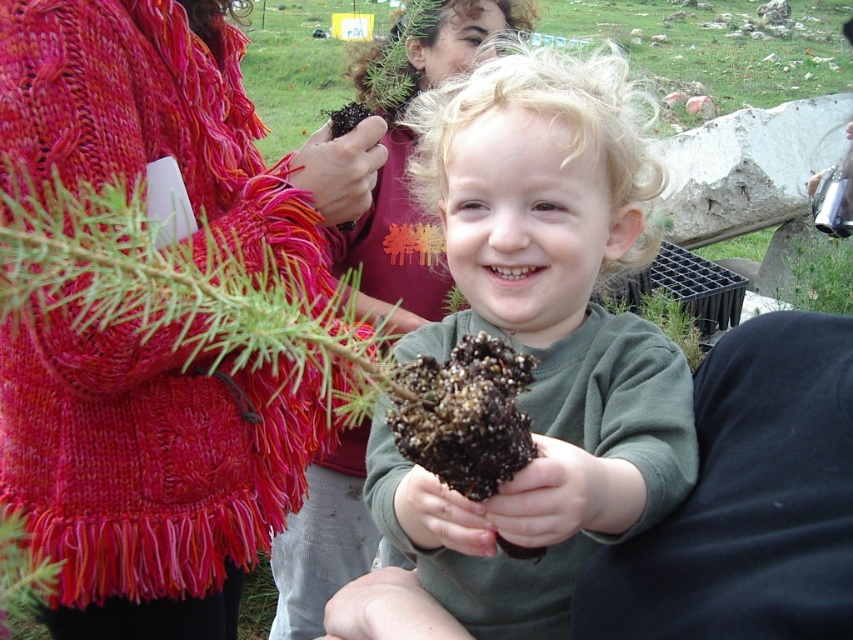
Question: Which object is farther from the camera taking this photo?

Choices:
 (A) knitted wool sweater at upper left
 (B) matte green sweater at center
 (C) matte red sweater at upper left
 (D) matte red sweater at center

Answer: (D)

Question: From the image, what is the correct spatial relationship of knitted wool sweater at upper left in relation to matte red sweater at upper left?

Choices:
 (A) left
 (B) right

Answer: (A)

Question: Is knitted wool sweater at upper left closer to camera compared to matte green sweater at center?

Choices:
 (A) yes
 (B) no

Answer: (B)

Question: Based on their relative distances, which object is farther from the knitted wool sweater at upper left?

Choices:
 (A) matte red sweater at center
 (B) matte red sweater at upper left

Answer: (A)

Question: Does knitted wool sweater at upper left have a lesser width compared to matte red sweater at center?

Choices:
 (A) yes
 (B) no

Answer: (B)

Question: Based on their relative distances, which object is nearer to the matte red sweater at center?

Choices:
 (A) knitted wool sweater at upper left
 (B) matte green sweater at center

Answer: (B)